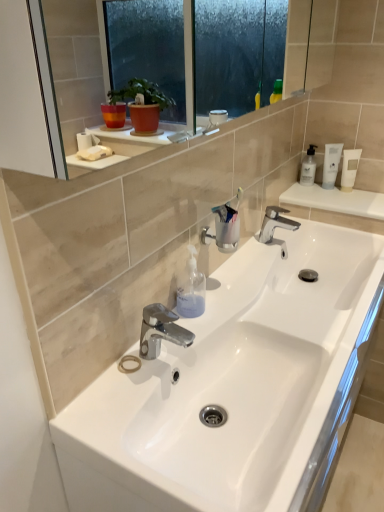
At what (x,y) coordinates should I click in order to perform the action: click on free space to the back side of chrome metallic faucet at center, the 2th tap viewed from the right. Please return your answer as a coordinate pair (x, y). This screenshot has width=384, height=512. Looking at the image, I should click on (195, 328).